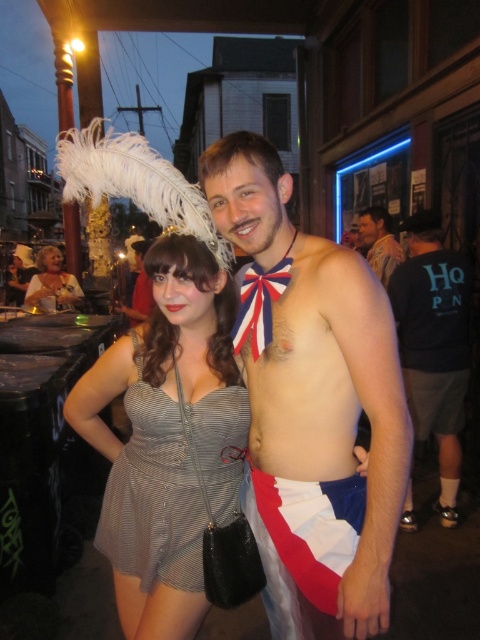
Question: From the image, what is the correct spatial relationship of dark blue t-shirt at center in relation to shiny metallic bow tie at center?

Choices:
 (A) below
 (B) above

Answer: (A)

Question: Estimate the real-world distances between objects in this image. Which object is closer to the dark blue t-shirt at center?

Choices:
 (A) white cotton flag at lower center
 (B) shiny metallic bow tie at center
 (C) matte silver dress at center

Answer: (B)

Question: Among these objects, which one is nearest to the camera?

Choices:
 (A) shiny metallic bow tie at center
 (B) shiny fabric bow tie at center
 (C) silver metallic dress at center

Answer: (B)

Question: Can you confirm if dark blue t-shirt at center is positioned to the left of shiny metallic bow tie at center?

Choices:
 (A) yes
 (B) no

Answer: (B)

Question: Which of these objects is positioned closest to the silver metallic dress at center?

Choices:
 (A) shiny metallic bow tie at center
 (B) white cotton flag at lower center
 (C) shiny fabric bow tie at center
 (D) matte silver dress at center

Answer: (B)

Question: Does matte silver dress at center have a larger size compared to shiny metallic bow tie at center?

Choices:
 (A) yes
 (B) no

Answer: (A)